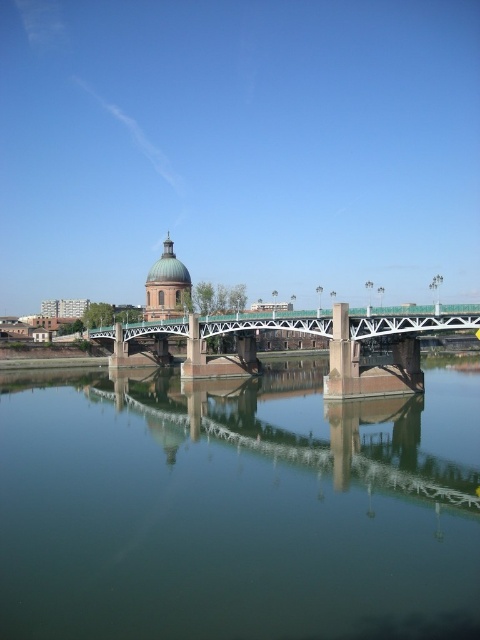
Based on the photo, can you confirm if green reflective water at center is positioned to the right of green metallic bridge at center?

No, green reflective water at center is not to the right of green metallic bridge at center.

Is point (442, 408) more distant than point (188, 342)?

That is False.

Locate an element on the screen. The height and width of the screenshot is (640, 480). green reflective water at center is located at coordinates (239, 508).